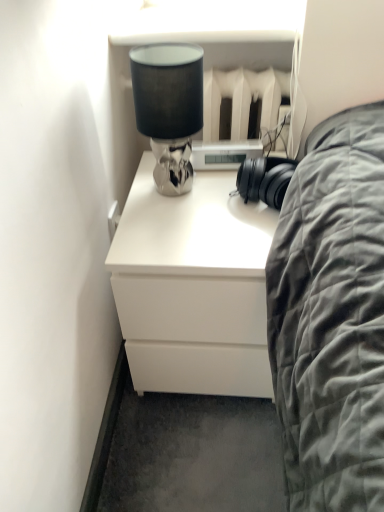
Question: From a real-world perspective, relative to white matte chest of drawers at center, is satin silver lamp at upper center vertically above or below?

Choices:
 (A) below
 (B) above

Answer: (B)

Question: In the image, is satin silver lamp at upper center positioned in front of or behind white matte chest of drawers at center?

Choices:
 (A) behind
 (B) front

Answer: (B)

Question: Is satin silver lamp at upper center taller or shorter than white matte chest of drawers at center?

Choices:
 (A) tall
 (B) short

Answer: (B)

Question: Is white matte chest of drawers at center taller or shorter than satin silver lamp at upper center?

Choices:
 (A) short
 (B) tall

Answer: (B)

Question: From the image's perspective, is white matte chest of drawers at center located above or below satin silver lamp at upper center?

Choices:
 (A) below
 (B) above

Answer: (A)

Question: Is white matte chest of drawers at center in front of or behind satin silver lamp at upper center in the image?

Choices:
 (A) front
 (B) behind

Answer: (B)

Question: Considering the positions of point (221, 293) and point (198, 114), is point (221, 293) closer or farther from the camera than point (198, 114)?

Choices:
 (A) farther
 (B) closer

Answer: (B)